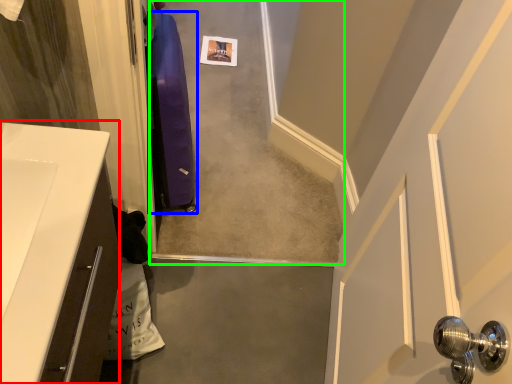
Question: Which object is positioned farthest from counter top (highlighted by a red box)? Select from luggage (highlighted by a blue box) and concrete (highlighted by a green box).

Choices:
 (A) luggage
 (B) concrete

Answer: (B)